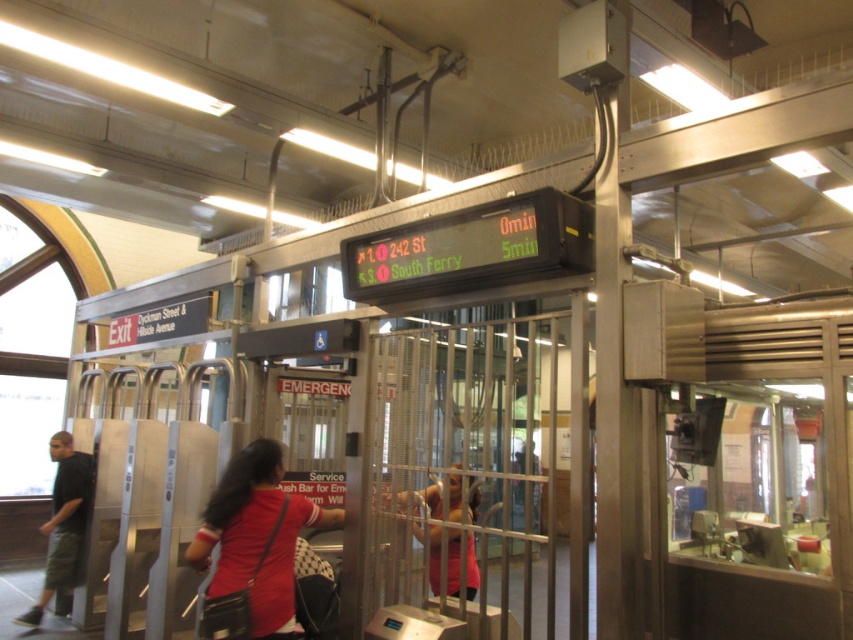
You are a passenger standing at the subway station and notice two people wearing a red fabric shirt at center and a pink fabric dress at center. Which clothing item is shorter in height?

The red fabric shirt at center is shorter in height compared to the pink fabric dress at center.

You are a fashion designer observing two shirts in a subway station scene. The red fabric shirt at center and the matte black shirt at left are both visible. Which shirt has a greater width?

The red fabric shirt at center has a greater width than the matte black shirt at left.

You are a subway passenger carrying a wide package. You see a red fabric shirt at center and a pink fabric dress at center. Which clothing item might block your path through the turnstiles?

The red fabric shirt at center might be wider than the pink fabric dress at center, so it could block your path through the turnstiles.